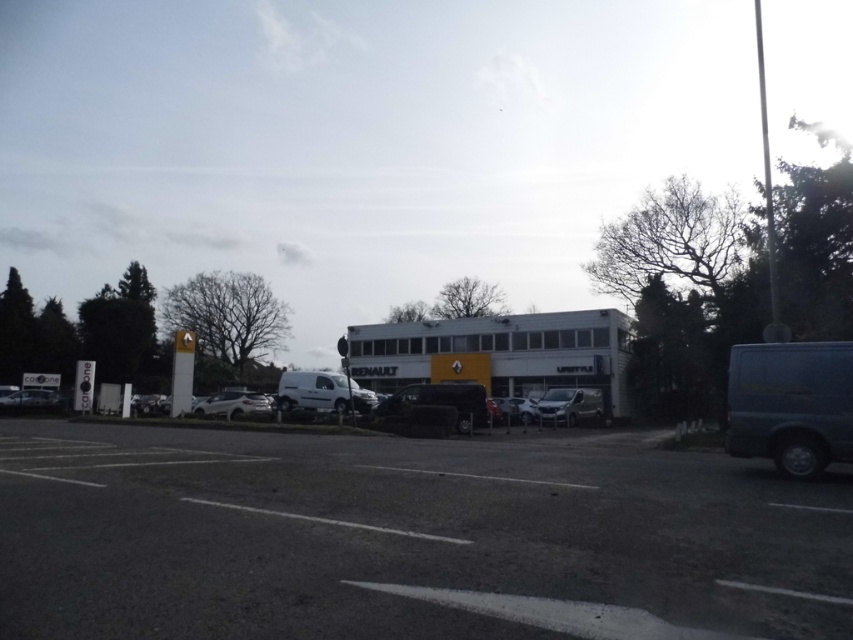
You are a delivery person who needs to park your truck in the Renault dealership parking lot. The truck requires a space larger than the shiny silver car at lower left. Can the dark asphalt parking lot at center accommodate your truck?

The dark asphalt parking lot at center is larger in size than the shiny silver car at lower left, so yes, the parking lot can accommodate the truck since it is bigger than the car.

You are a delivery driver who needs to park your vehicle in a space that can accommodate the widest van between the white matte van at center and the satin silver van at center. Which van should you choose to park?

The white matte van at center is wider than the satin silver van at center, so you should choose the white matte van at center to park in the space designed for the widest van.